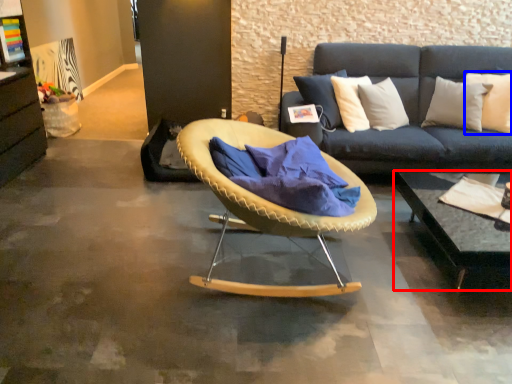
Question: Which object appears farthest to the camera in this image, coffee table (highlighted by a red box) or pillow (highlighted by a blue box)?

Choices:
 (A) coffee table
 (B) pillow

Answer: (B)